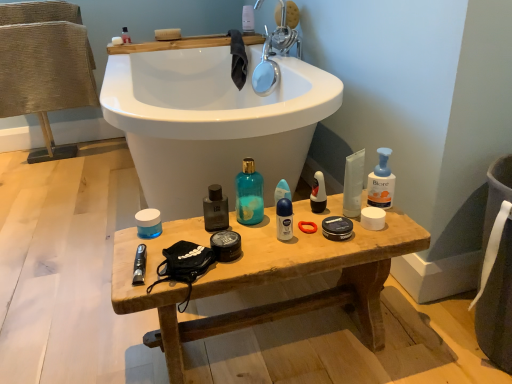
Locate an element on the screen. The height and width of the screenshot is (384, 512). vacant area situated to the left side of white matte tube at center right, which is the 2th cleaning product in left-to-right order is located at coordinates (295, 223).